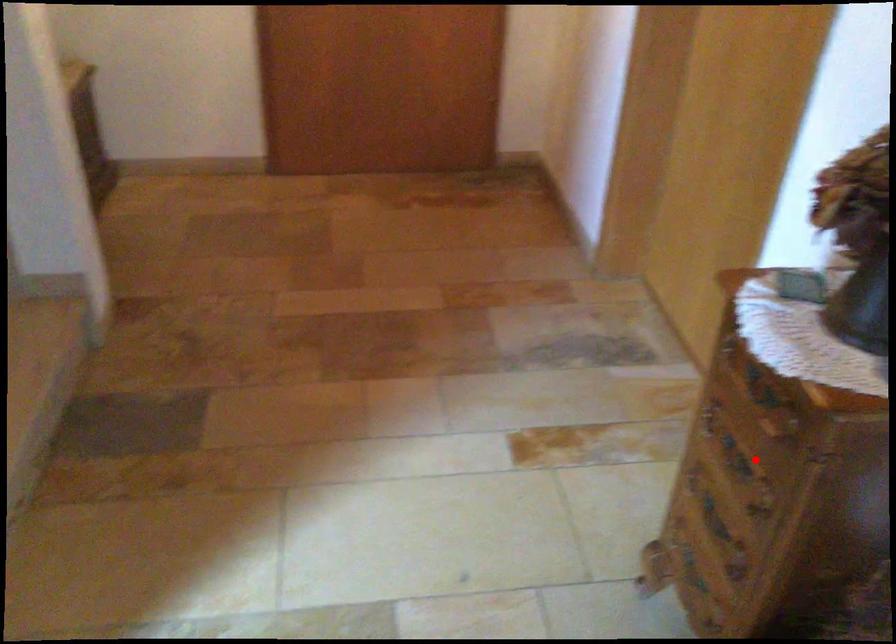
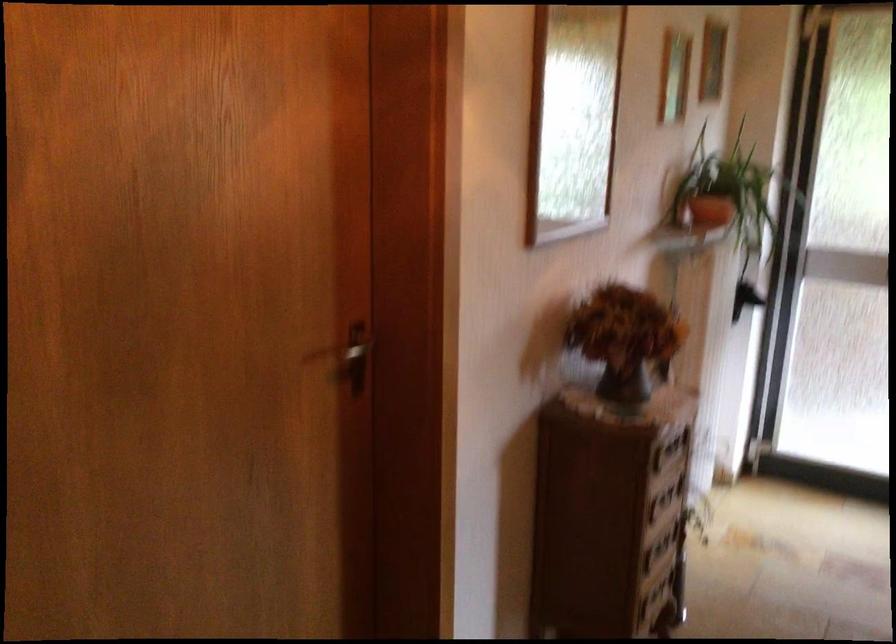
In the second image, find the point that corresponds to the highlighted location in the first image.

(659, 504)